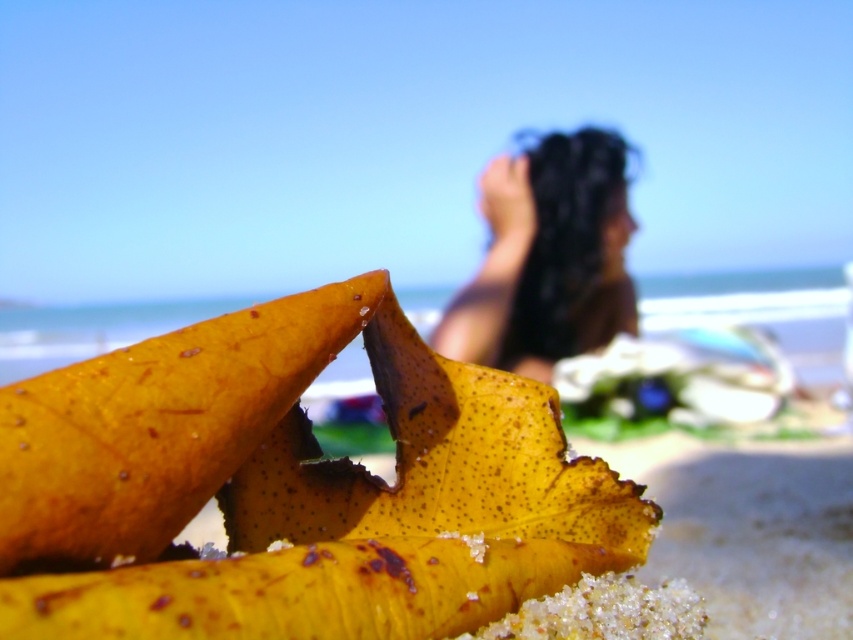
Can you confirm if yellow papery banana at center is positioned above dark brown hair at upper center?

No.

You are a GUI agent. You are given a task and a screenshot of the screen. Output one action in this format:
    pyautogui.click(x=<x>, y=<y>)
    Task: Click on the yellow papery banana at center
    The height and width of the screenshot is (640, 853).
    Given the screenshot: What is the action you would take?
    pyautogui.click(x=293, y=486)

Find the location of a particular element. yellow papery banana at center is located at coordinates (293, 486).